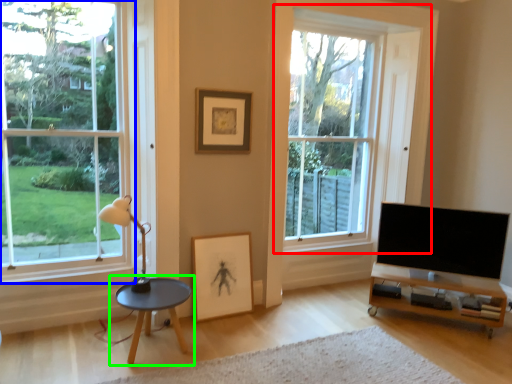
Question: Based on their relative distances, which object is nearer to window (highlighted by a red box)? Choose from window (highlighted by a blue box) and coffee table (highlighted by a green box).

Choices:
 (A) window
 (B) coffee table

Answer: (A)